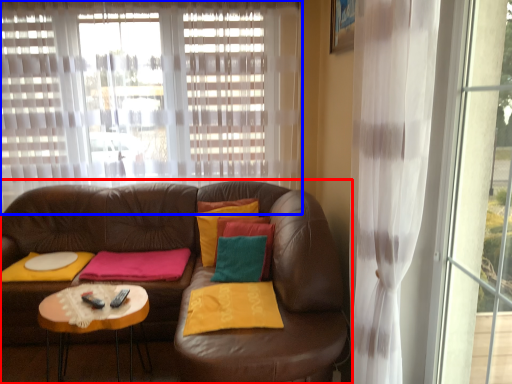
Question: Which of the following is the closest to the observer, studio couch (highlighted by a red box) or curtain (highlighted by a blue box)?

Choices:
 (A) studio couch
 (B) curtain

Answer: (A)